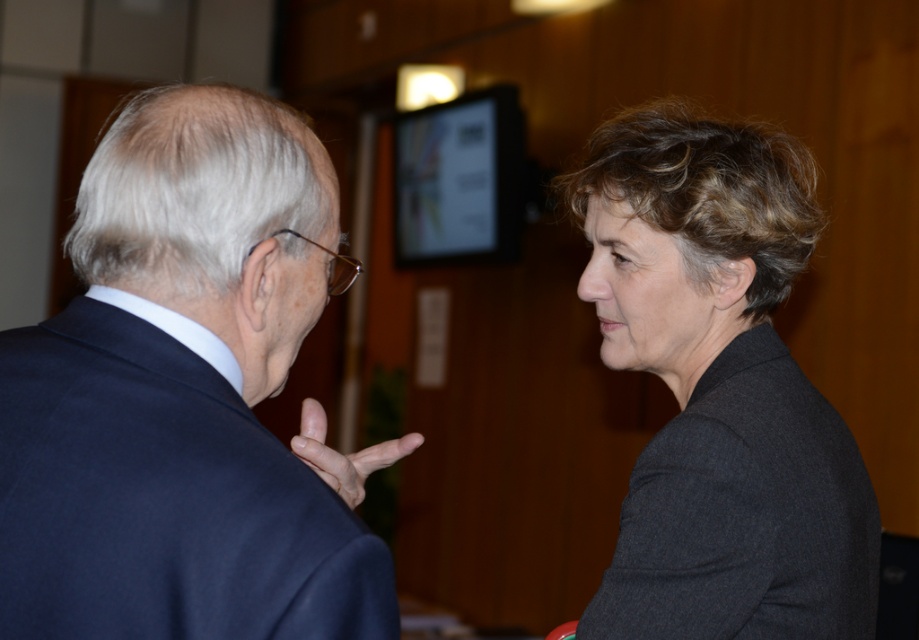
Question: Is dark gray woolen blazer at right smaller than matte black hand at center?

Choices:
 (A) no
 (B) yes

Answer: (A)

Question: Does dark blue suit at left have a lesser width compared to dark gray woolen blazer at right?

Choices:
 (A) no
 (B) yes

Answer: (B)

Question: Does dark blue suit at left appear on the right side of matte black hand at center?

Choices:
 (A) no
 (B) yes

Answer: (A)

Question: Among these points, which one is farthest from the camera?

Choices:
 (A) (861, 620)
 (B) (360, 483)

Answer: (A)

Question: Estimate the real-world distances between objects in this image. Which object is farther from the matte black hand at center?

Choices:
 (A) dark gray woolen blazer at right
 (B) dark blue suit at left

Answer: (A)

Question: Among these points, which one is nearest to the camera?

Choices:
 (A) (220, 259)
 (B) (872, 557)

Answer: (A)